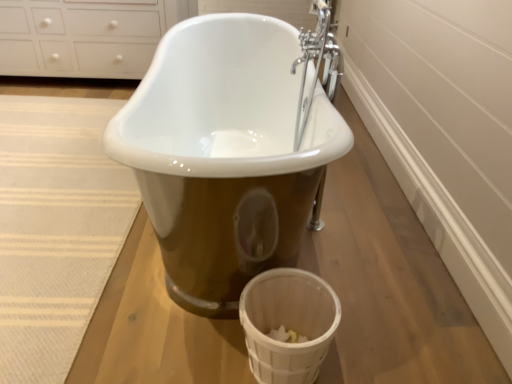
Where is `free space that is to the left of white woven basket at lower right`? free space that is to the left of white woven basket at lower right is located at coordinates (199, 344).